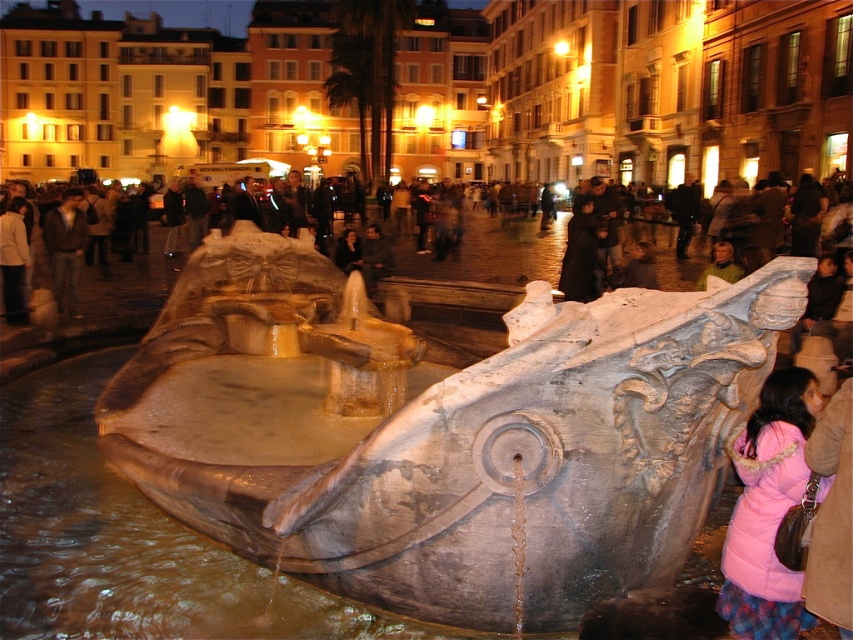
Question: Is pink puffy coat at lower right below pink fabric coat at lower right?

Choices:
 (A) no
 (B) yes

Answer: (B)

Question: Which of the following is the farthest from the observer?

Choices:
 (A) pink puffy coat at lower right
 (B) pink fabric coat at lower right

Answer: (B)

Question: Can you confirm if pink puffy coat at lower right is positioned to the left of pink fabric coat at lower right?

Choices:
 (A) yes
 (B) no

Answer: (B)

Question: In this image, where is pink puffy coat at lower right located relative to pink fabric coat at lower right?

Choices:
 (A) right
 (B) left

Answer: (A)